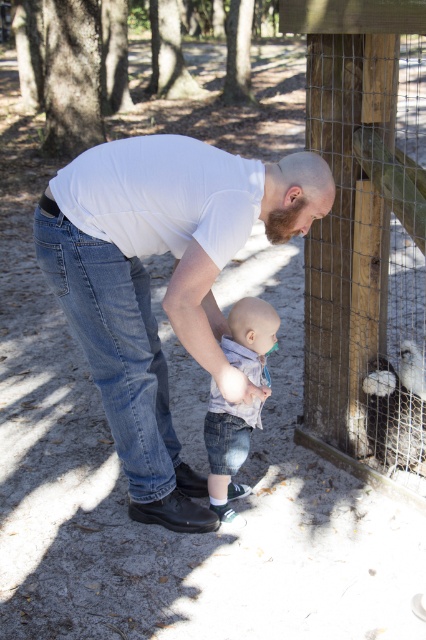
You are a painter standing at the edge of the scene. You need to paint both the white matte shirt at center and the wooden post at right. Which object should you paint first if you want to start with the closer one?

The white matte shirt at center should be painted first because it is closer to you than the wooden post at right.

You are a painter standing at the edge of the scene. You need to paint both the white matte shirt at center and the wooden post at right. Which object should you paint first if you want to paint the thinner one first?

The white matte shirt at center is thinner than the wooden post at right, so you should paint the white matte shirt at center first.